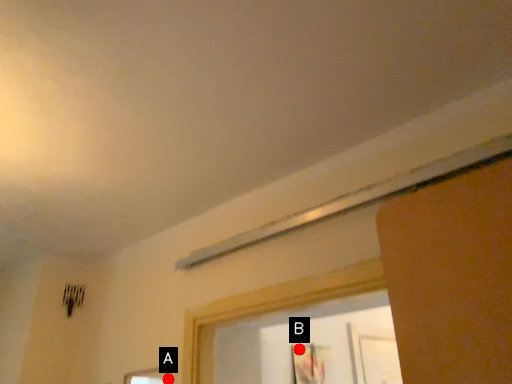
Question: Two points are circled on the image, labeled by A and B beside each circle. Which point is closer to the camera?

Choices:
 (A) A is closer
 (B) B is closer

Answer: (A)